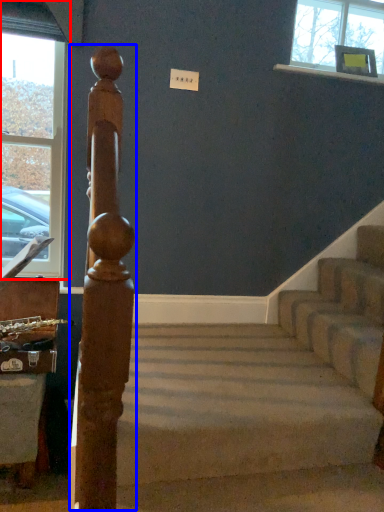
Question: Which object is closer to the camera taking this photo, window (highlighted by a red box) or beam (highlighted by a blue box)?

Choices:
 (A) window
 (B) beam

Answer: (B)